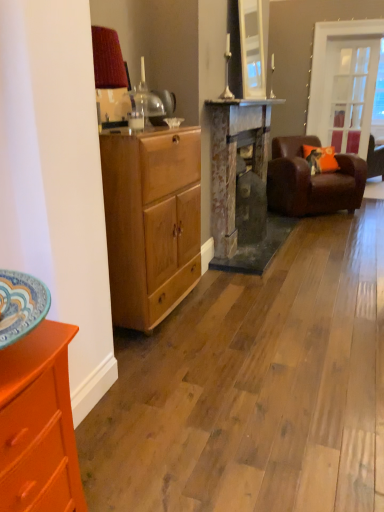
In order to click on light brown wood cabinet at left in this screenshot , I will do `click(151, 222)`.

The height and width of the screenshot is (512, 384). I want to click on rusty metal fireplace at center, so click(241, 186).

From the picture: In order to face clear glass door at upper right, should I rotate leftwards or rightwards?

Turn right approximately 20.866 degrees to face it.

Locate an element on the screen. The image size is (384, 512). brown leather armchair at right is located at coordinates (311, 181).

This screenshot has height=512, width=384. Find the location of `brown leather couch at right`. brown leather couch at right is located at coordinates (375, 159).

The height and width of the screenshot is (512, 384). I want to click on orange wood dresser at lower left, so click(38, 424).

Identify the location of orange fabric pillow at right. The height and width of the screenshot is (512, 384). (320, 159).

Looking at this image, does orange fabric pillow at right have a lesser width compared to orange wood dresser at lower left?

Yes.

How much distance is there between orange fabric pillow at right and orange wood dresser at lower left?

orange fabric pillow at right and orange wood dresser at lower left are 4.38 meters apart from each other.

Is orange fabric pillow at right in contact with orange wood dresser at lower left?

No, orange fabric pillow at right is not beside orange wood dresser at lower left.

In the scene shown: Is orange fabric pillow at right inside or outside of orange wood dresser at lower left?

orange fabric pillow at right is located beyond the bounds of orange wood dresser at lower left.

From a real-world perspective, is orange wood dresser at lower left beneath brown leather couch at right?

Yes, from a real-world perspective, orange wood dresser at lower left is below brown leather couch at right.

Is orange wood dresser at lower left taller than brown leather couch at right?

In fact, orange wood dresser at lower left may be shorter than brown leather couch at right.

Who is more distant, orange wood dresser at lower left or brown leather couch at right?

Positioned behind is brown leather couch at right.

Which is more distant, (373,148) or (21,347)?

Point (373,148)

Image resolution: width=384 pixels, height=512 pixels. In the image, there is a brown leather couch at right. Find the location of `cabinetry below it (from the image's perspective)`. cabinetry below it (from the image's perspective) is located at coordinates (38, 424).

Considering the sizes of objects brown leather couch at right and orange wood dresser at lower left in the image provided, who is wider, brown leather couch at right or orange wood dresser at lower left?

brown leather couch at right.

In the scene shown: Is the depth of brown leather couch at right greater than that of orange wood dresser at lower left?

That is True.

Does rusty metal fireplace at center have a greater width compared to orange fabric pillow at right?

No, rusty metal fireplace at center is not wider than orange fabric pillow at right.

How far apart are rusty metal fireplace at center and orange fabric pillow at right?

rusty metal fireplace at center is 4.77 feet from orange fabric pillow at right.

Is rusty metal fireplace at center bigger or smaller than orange fabric pillow at right?

In the image, rusty metal fireplace at center appears to be larger than orange fabric pillow at right.

Is rusty metal fireplace at center positioned beyond the bounds of orange fabric pillow at right?

Yes, rusty metal fireplace at center is not within orange fabric pillow at right.

Which object is thinner, light brown wood cabinet at left or brown leather couch at right?

With smaller width is light brown wood cabinet at left.

Identify the location of desk in front of the brown leather couch at right. This screenshot has height=512, width=384. (151, 222).

Consider the image. Is light brown wood cabinet at left not near brown leather couch at right?

light brown wood cabinet at left is positioned a significant distance from brown leather couch at right.

Is light brown wood cabinet at left positioned with its back to brown leather couch at right?

No, brown leather couch at right is not at the back of light brown wood cabinet at left.

Is rusty metal fireplace at center to the right of orange wood dresser at lower left from the viewer's perspective?

Yes.

From a real-world perspective, is rusty metal fireplace at center below orange wood dresser at lower left?

No.

Is orange wood dresser at lower left located within rusty metal fireplace at center?

No.

Would you say rusty metal fireplace at center is inside or outside clear glass door at upper right?

rusty metal fireplace at center exists outside the volume of clear glass door at upper right.

Could you tell me if rusty metal fireplace at center is turned towards clear glass door at upper right?

No.

Is point (236, 201) closer or farther from the camera than point (340, 86)?

Point (236, 201) appears to be closer to the viewer than point (340, 86).

From a real-world perspective, which is physically below, rusty metal fireplace at center or clear glass door at upper right?

rusty metal fireplace at center is physically lower.

This screenshot has height=512, width=384. Find the location of `pillow located above the orange wood dresser at lower left (from the image's perspective)`. pillow located above the orange wood dresser at lower left (from the image's perspective) is located at coordinates (320, 159).

Identify the location of studio couch that is behind the orange wood dresser at lower left. (375, 159).

From the image, which object appears to be farther from rusty metal fireplace at center, clear glass door at upper right or orange fabric pillow at right?

clear glass door at upper right.

Based on the photo, from the image, which object appears to be farther from rusty metal fireplace at center, brown leather couch at right or clear glass door at upper right?

clear glass door at upper right is positioned further to the anchor rusty metal fireplace at center.

When comparing their distances from light brown wood cabinet at left, does brown leather armchair at right or orange wood dresser at lower left seem closer?

orange wood dresser at lower left.

In the scene shown: Which object lies nearer to the anchor point rusty metal fireplace at center, clear glass door at upper right or brown leather armchair at right?

brown leather armchair at right lies closer to rusty metal fireplace at center than the other object.

Based on their spatial positions, is brown leather couch at right or brown leather armchair at right further from rusty metal fireplace at center?

brown leather couch at right lies further to rusty metal fireplace at center than the other object.

When comparing their distances from orange fabric pillow at right, does brown leather armchair at right or brown leather couch at right seem further?

The object further to orange fabric pillow at right is brown leather couch at right.

Looking at the image, which one is located further to orange wood dresser at lower left, orange fabric pillow at right or rusty metal fireplace at center?

Among the two, orange fabric pillow at right is located further to orange wood dresser at lower left.

From the image, which object appears to be nearer to light brown wood cabinet at left, clear glass door at upper right or orange fabric pillow at right?

Among the two, orange fabric pillow at right is located nearer to light brown wood cabinet at left.

This screenshot has height=512, width=384. I want to click on desk between orange wood dresser at lower left and rusty metal fireplace at center in the front-back direction, so click(x=151, y=222).

Identify the location of fireplace between orange wood dresser at lower left and clear glass door at upper right from front to back. This screenshot has width=384, height=512. (241, 186).

Identify the location of fireplace positioned between light brown wood cabinet at left and brown leather couch at right from near to far. (241, 186).

Where is `glass door between rusty metal fireplace at center and brown leather couch at right in the front-back direction`? This screenshot has width=384, height=512. glass door between rusty metal fireplace at center and brown leather couch at right in the front-back direction is located at coordinates (350, 93).